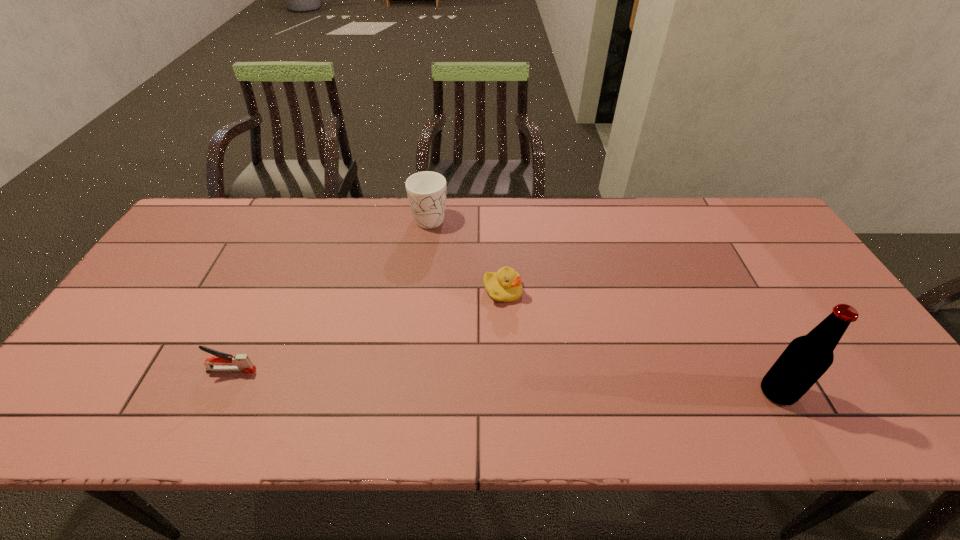
In order to click on the leftmost object in this screenshot , I will do `click(242, 363)`.

The height and width of the screenshot is (540, 960). What are the coordinates of `stapler` in the screenshot? It's located at (242, 363).

The width and height of the screenshot is (960, 540). What are the coordinates of `the tallest object` in the screenshot? It's located at (806, 358).

This screenshot has height=540, width=960. Find the location of `the nearest object`. the nearest object is located at coordinates (806, 358).

The height and width of the screenshot is (540, 960). I want to click on mug, so [x=426, y=191].

You are a GUI agent. You are given a task and a screenshot of the screen. Output one action in this format:
    pyautogui.click(x=<x>, y=<y>)
    Task: Click on the farthest object
    Image resolution: width=960 pixels, height=540 pixels.
    Given the screenshot: What is the action you would take?
    coord(426,191)

What are the coordinates of `the second object from right to left` in the screenshot? It's located at (505, 285).

Image resolution: width=960 pixels, height=540 pixels. I want to click on duckling, so click(x=505, y=285).

The height and width of the screenshot is (540, 960). Identify the location of vacant space located on the handle side of the second nearest object. [353, 370].

You are a GUI agent. You are given a task and a screenshot of the screen. Output one action in this format:
    pyautogui.click(x=<x>, y=<y>)
    Task: Click on the free region located 0.340m on the back of the tallest object
    The height and width of the screenshot is (540, 960).
    Given the screenshot: What is the action you would take?
    pyautogui.click(x=714, y=275)